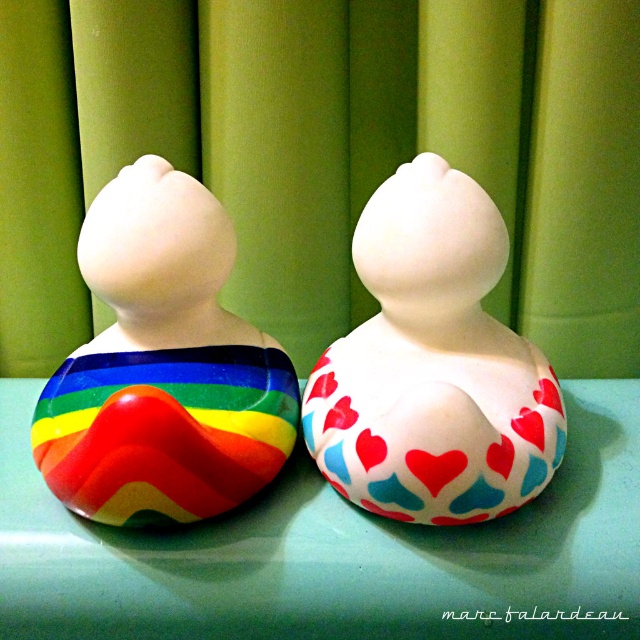
You are arranging a display and need to place a small vase between the green glossy table at center and the matte white rubber duck at center. Which object should the vase be placed in front of to ensure it is visible to someone standing in front of the display?

The vase should be placed in front of the matte white rubber duck at center because the green glossy table at center is closer to the viewer. Placing the vase in front of the duck ensures it is visible without being obscured by the table.

You are a photographer standing at the camera position. The green glossy table at center has a 35.75 inch ruler placed on it. If you want to place your camera exactly 36 inches away from the table, should you move closer or farther away?

The camera is currently 35.75 inches away from the green glossy table at center. Since 35.75 is less than 36, you need to move slightly farther away to reach the desired distance.

You are a child sitting at the green glossy table at center and want to reach the rainbow glossy rubber duck at left. Can you easily grab it without moving your chair?

The rainbow glossy rubber duck at left is behind the green glossy table at center, so it is out of reach from your current position. You would need to move your chair or the table to access it.